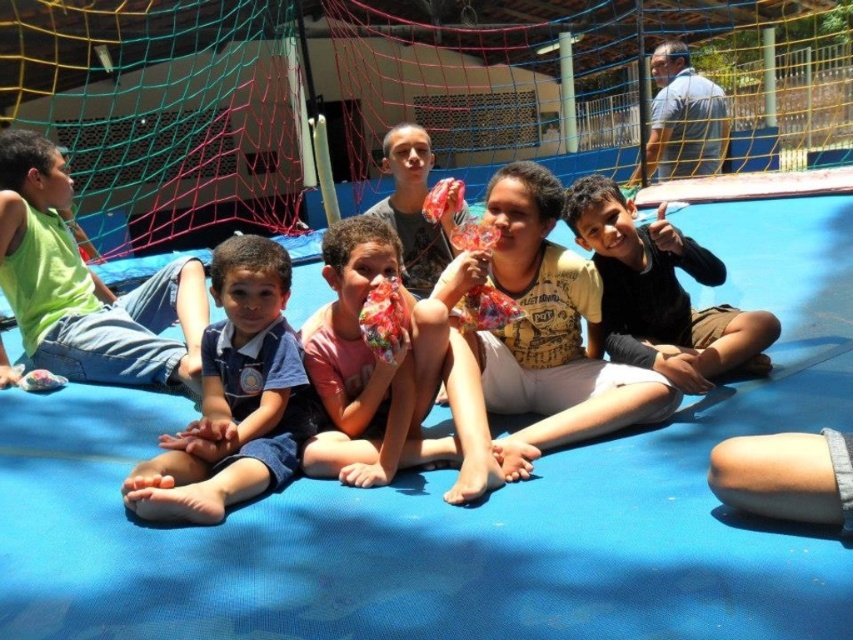
Looking at this image, you are a child sitting on the bright blue mat and want to reach for the pink matte candy at center and the matte plastic bag at center. Which one is closer to you?

The pink matte candy at center is closer to you since it is 1.05 meters away from the matte plastic bag at center, meaning the candy is nearer than the bag.

You are standing in front of the image and want to locate the blue denim shorts at left. What are their exact coordinates in the image?

The blue denim shorts at left are located at coordinates point (234,397).